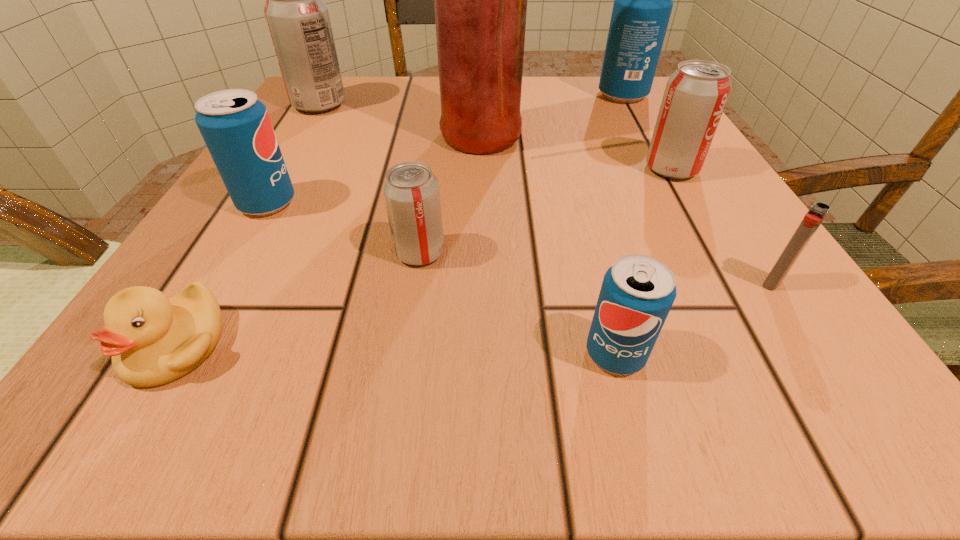
Locate which object ranks seventh in proximity to the second nearest blue soda can. Please provide its 2D coordinates. Your answer should be formatted as a tuple, i.e. [(x, y)], where the tuple contains the x and y coordinates of a point satisfying the conditions above.

[(643, 0)]

At what (x,y) coordinates should I click in order to perform the action: click on soda can that is the sixth nearest to the duckling. Please return your answer as a coordinate pair (x, y). The width and height of the screenshot is (960, 540). Looking at the image, I should click on (643, 0).

What are the coordinates of `soda can that is the fourth closest to the shortest object` in the screenshot? It's located at (298, 20).

Choose which blue soda can is the nearest neighbor to the red fire extinguisher. Please provide its 2D coordinates. Your answer should be formatted as a tuple, i.e. [(x, y)], where the tuple contains the x and y coordinates of a point satisfying the conditions above.

[(643, 0)]

This screenshot has height=540, width=960. Find the location of `the second closest blue soda can to the rightmost gray soda can`. the second closest blue soda can to the rightmost gray soda can is located at coordinates (638, 291).

Identify which gray soda can is the third nearest to the nearest soda can. Please provide its 2D coordinates. Your answer should be formatted as a tuple, i.e. [(x, y)], where the tuple contains the x and y coordinates of a point satisfying the conditions above.

[(298, 20)]

Choose which gray soda can is the second nearest neighbor to the third nearest object. Please provide its 2D coordinates. Your answer should be formatted as a tuple, i.e. [(x, y)], where the tuple contains the x and y coordinates of a point satisfying the conditions above.

[(411, 191)]

The height and width of the screenshot is (540, 960). I want to click on vacant space that satisfies the following two spatial constraints: 1. on the back side of the third nearest object; 2. on the side of the red fire extinguisher with the label, so click(x=679, y=140).

Find the location of `vacant area that satisfies the following two spatial constraints: 1. on the side of the fire extinguisher with the label; 2. on the left side of the nearest soda can`. vacant area that satisfies the following two spatial constraints: 1. on the side of the fire extinguisher with the label; 2. on the left side of the nearest soda can is located at coordinates (472, 354).

In order to click on vacant space that satisfies the following two spatial constraints: 1. on the side of the red fire extinguisher with the label; 2. on the front-facing side of the duckling in this screenshot , I will do 472,345.